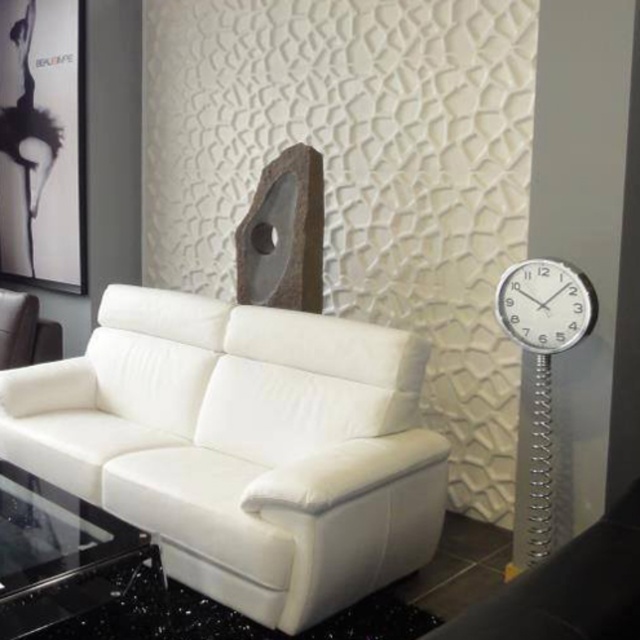
Question: Can you confirm if white leather couch at center is wider than transparent glass table at lower left?

Choices:
 (A) yes
 (B) no

Answer: (A)

Question: Estimate the real-world distances between objects in this image. Which object is farther from the metallic silver clock at right?

Choices:
 (A) transparent glass table at lower left
 (B) white leather armchair at left
 (C) white leather couch at center
 (D) matte black picture frame at upper left

Answer: (D)

Question: Which point is closer to the camera taking this photo?

Choices:
 (A) (4, 362)
 (B) (346, 449)
 (C) (26, 493)
 (D) (74, 230)

Answer: (C)

Question: Which of the following is the closest to the observer?

Choices:
 (A) (33, 324)
 (B) (86, 566)
 (C) (552, 342)

Answer: (B)

Question: Is matte black picture frame at upper left closer to the viewer compared to metallic silver clock at right?

Choices:
 (A) yes
 (B) no

Answer: (B)

Question: Does matte black picture frame at upper left have a smaller size compared to transparent glass table at lower left?

Choices:
 (A) yes
 (B) no

Answer: (B)